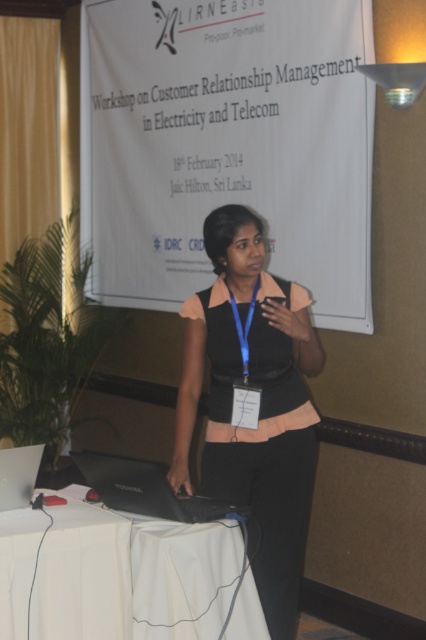
Question: Can you confirm if matte black laptop at center is smaller than black matte laptop at lower center?

Choices:
 (A) yes
 (B) no

Answer: (B)

Question: Can you confirm if white cloth-covered table at lower center is thinner than black matte laptop at lower center?

Choices:
 (A) no
 (B) yes

Answer: (A)

Question: Can you confirm if black matte laptop at lower center is positioned above silver metallic laptop at lower left?

Choices:
 (A) no
 (B) yes

Answer: (A)

Question: Which is farther from the white cloth-covered table at lower center?

Choices:
 (A) black matte vest at center
 (B) black matte laptop at lower center
 (C) matte black laptop at center

Answer: (C)

Question: Based on their relative distances, which object is farther from the black matte laptop at lower center?

Choices:
 (A) matte black laptop at center
 (B) white cloth-covered table at lower center

Answer: (A)

Question: Which point is closer to the camera taking this photo?

Choices:
 (A) (158, 573)
 (B) (28, 483)
 (C) (229, 513)

Answer: (A)